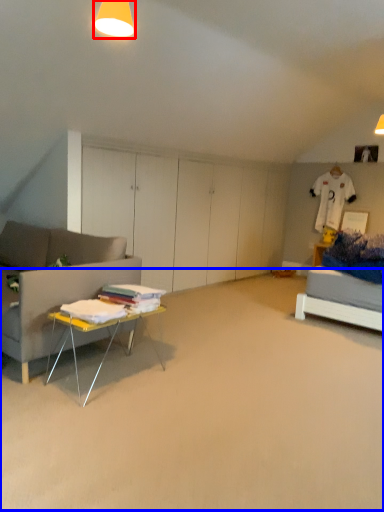
Question: Which object is further to the camera taking this photo, lighting (highlighted by a red box) or plain (highlighted by a blue box)?

Choices:
 (A) lighting
 (B) plain

Answer: (A)